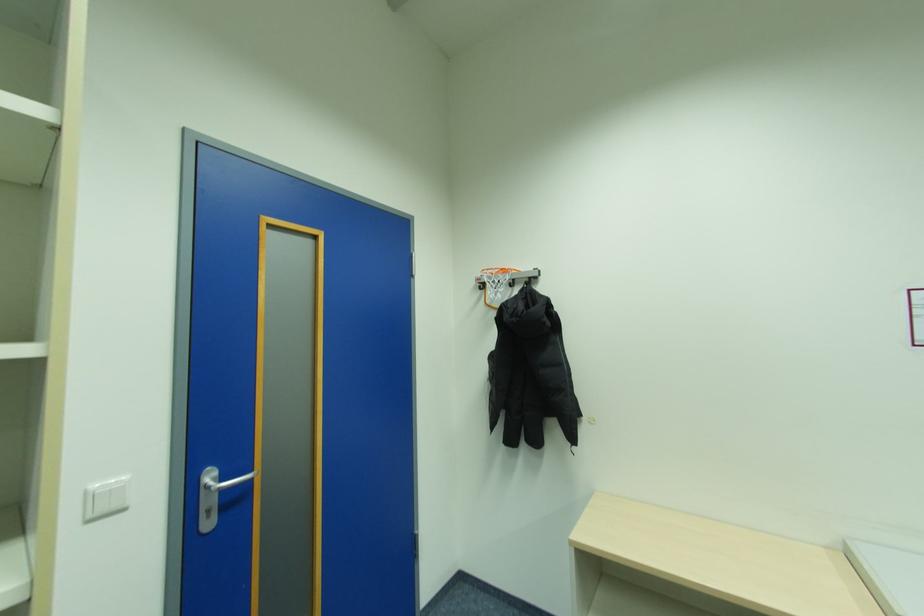
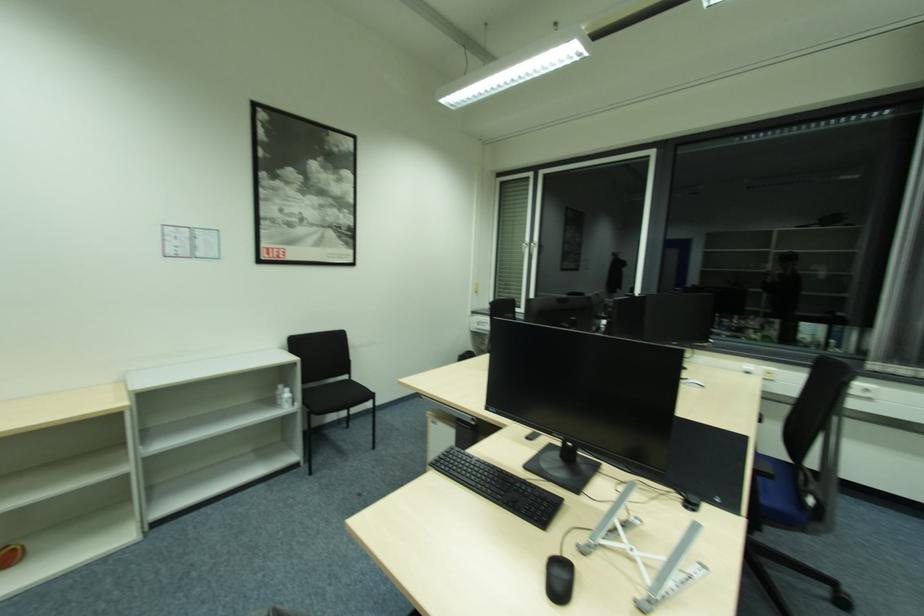
Question: How did the camera likely rotate?

Choices:
 (A) Left
 (B) Right
 (C) Up
 (D) Down

Answer: (B)